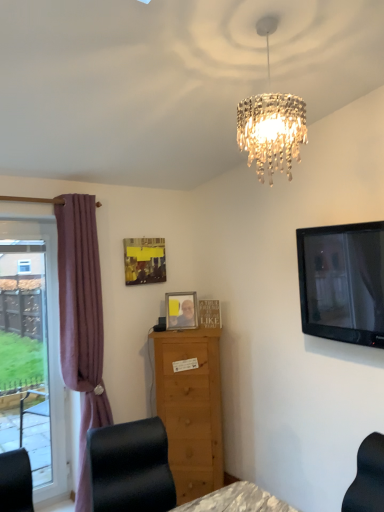
Question: From a real-world perspective, is wooden picture frame at center, positioned as the 1th picture frame in right-to-left order, on black glossy tv at upper right?

Choices:
 (A) no
 (B) yes

Answer: (A)

Question: Is wooden picture frame at center, which is the 3th picture frame in left-to-right order, bigger than black glossy tv at upper right?

Choices:
 (A) no
 (B) yes

Answer: (A)

Question: Is wooden picture frame at center, positioned as the 1th picture frame in right-to-left order, turned away from black glossy tv at upper right?

Choices:
 (A) yes
 (B) no

Answer: (B)

Question: Is wooden picture frame at center, which is the 3th picture frame in left-to-right order, next to black glossy tv at upper right?

Choices:
 (A) yes
 (B) no

Answer: (B)

Question: From the image's perspective, would you say wooden picture frame at center, positioned as the 1th picture frame in right-to-left order, is shown under black glossy tv at upper right?

Choices:
 (A) no
 (B) yes

Answer: (B)

Question: Is mauve fabric curtain at left wider or thinner than black leather chair at lower left?

Choices:
 (A) wide
 (B) thin

Answer: (B)

Question: In the image, is mauve fabric curtain at left positioned in front of or behind black leather chair at lower left?

Choices:
 (A) front
 (B) behind

Answer: (B)

Question: Is point pyautogui.click(x=76, y=259) closer or farther from the camera than point pyautogui.click(x=107, y=504)?

Choices:
 (A) closer
 (B) farther

Answer: (B)

Question: From the image's perspective, is mauve fabric curtain at left located above or below black leather chair at lower left?

Choices:
 (A) below
 (B) above

Answer: (B)

Question: Choose the correct answer: Is light brown wooden chest of drawers at center inside clear glass window at left or outside it?

Choices:
 (A) inside
 (B) outside

Answer: (B)

Question: From a real-world perspective, relative to clear glass window at left, is light brown wooden chest of drawers at center vertically above or below?

Choices:
 (A) above
 (B) below

Answer: (B)

Question: From their relative heights in the image, would you say light brown wooden chest of drawers at center is taller or shorter than clear glass window at left?

Choices:
 (A) tall
 (B) short

Answer: (B)

Question: Considering the positions of light brown wooden chest of drawers at center and clear glass window at left in the image, is light brown wooden chest of drawers at center wider or thinner than clear glass window at left?

Choices:
 (A) wide
 (B) thin

Answer: (A)

Question: From the image's perspective, is matte yellow picture frame at upper center, which is the 3th picture frame from right to left, located above or below wooden picture frame at center, which is the 3th picture frame in left-to-right order?

Choices:
 (A) above
 (B) below

Answer: (A)

Question: From a real-world perspective, is matte yellow picture frame at upper center, which is the first picture frame in left-to-right order, positioned above or below wooden picture frame at center, positioned as the 1th picture frame in right-to-left order?

Choices:
 (A) below
 (B) above

Answer: (B)